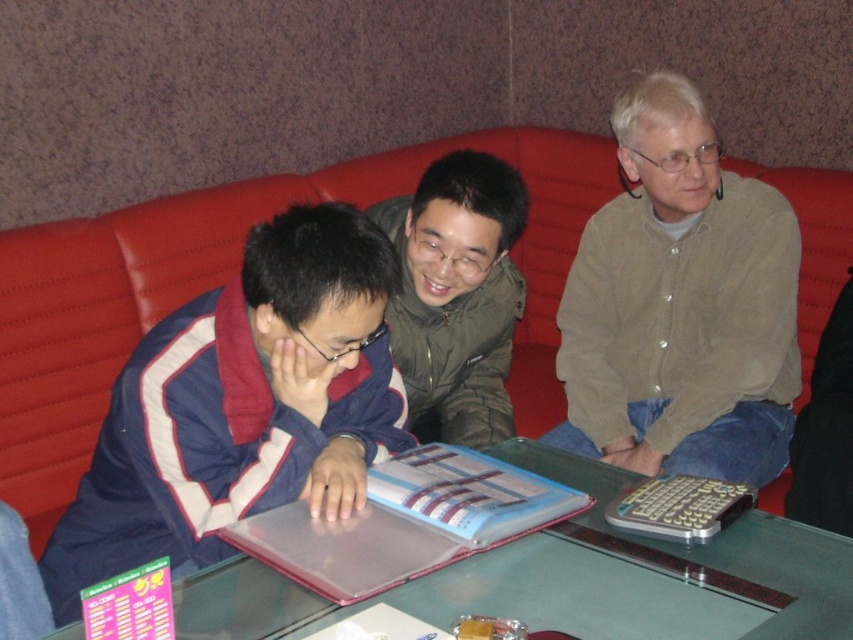
You are standing in front of the bench and want to hand a brochure to the person wearing the blue fabric jacket at center. Based on their position, where should you aim to place the brochure so it reaches them?

The blue fabric jacket at center is located at coordinates approximately 0.634 on the x and 0.285 on the y axis. To ensure the brochure reaches them, aim just to the right of center horizontally and slightly lower vertically, aligning with these coordinates.